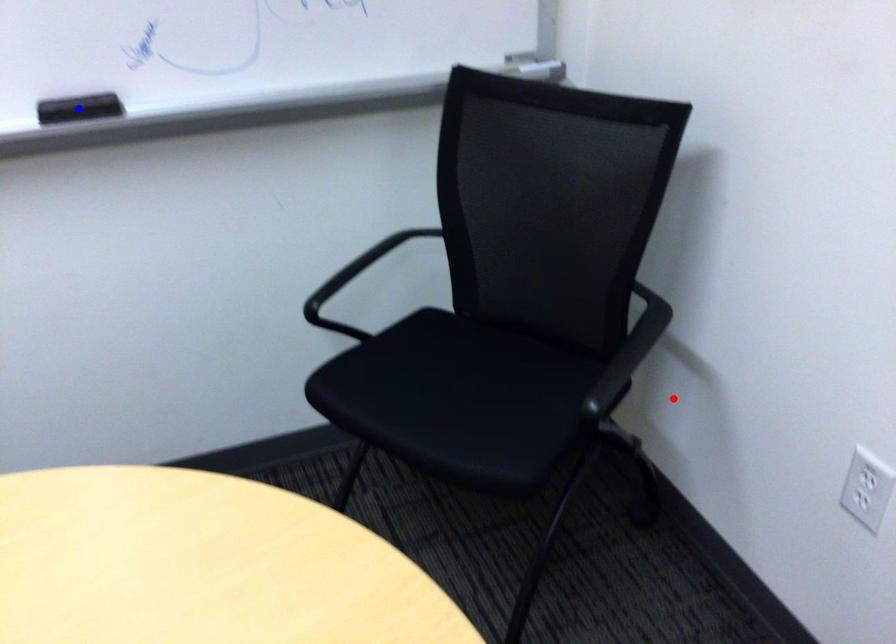
Question: Which of the two points in the image is closer to the camera?

Choices:
 (A) Blue point is closer.
 (B) Red point is closer.

Answer: (A)